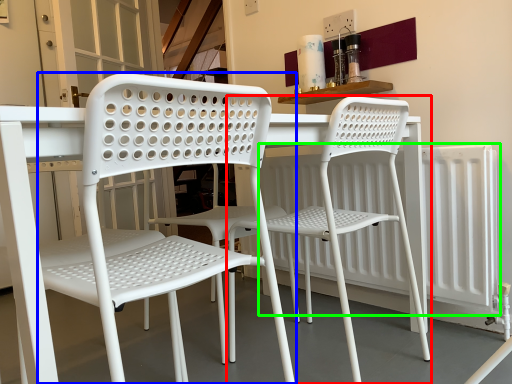
Question: Which object is the closest to the chair (highlighted by a red box)? Choose among these: chair (highlighted by a blue box) or radiator (highlighted by a green box).

Choices:
 (A) chair
 (B) radiator

Answer: (B)